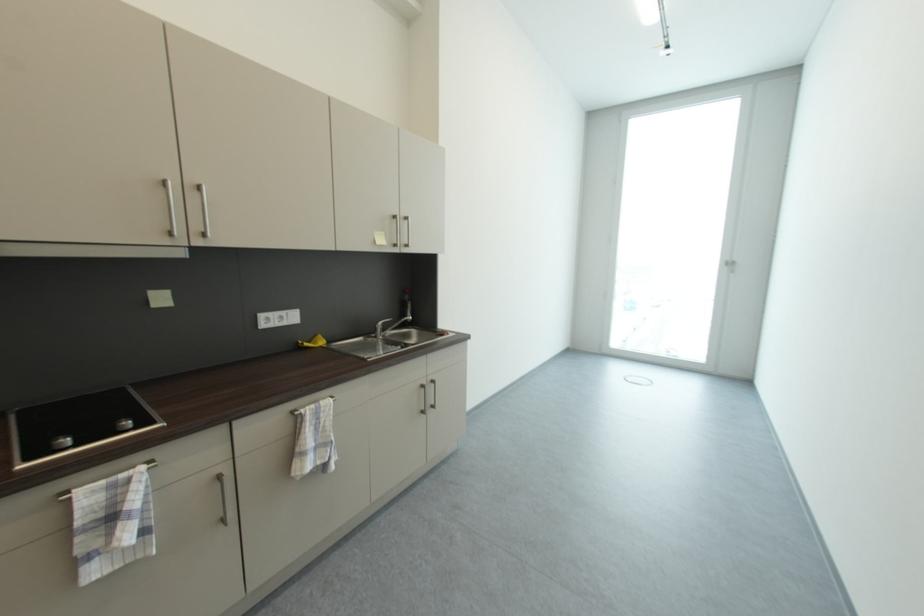
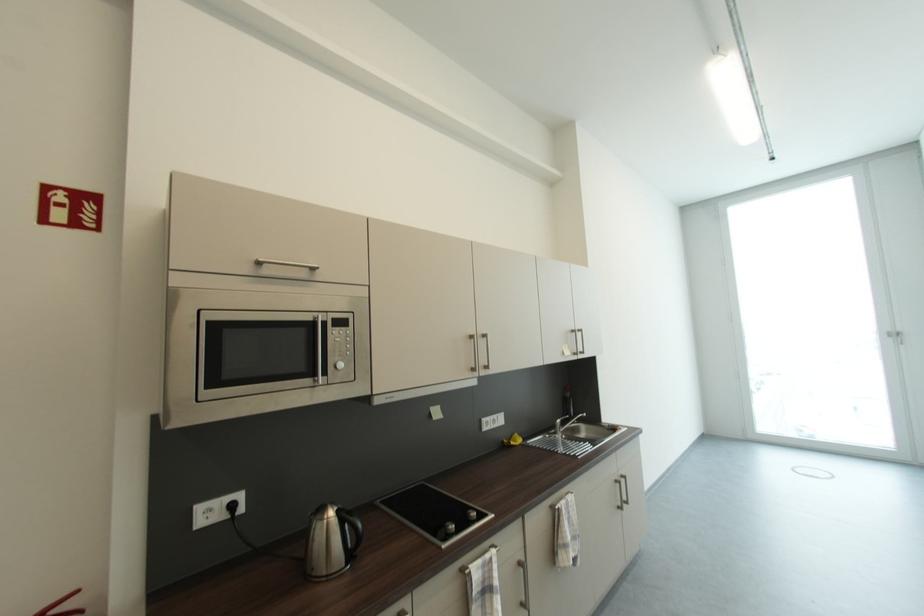
In the scene shown: Which direction would the cameraman need to move to produce the second image?

The cameraman moved toward left, backward.